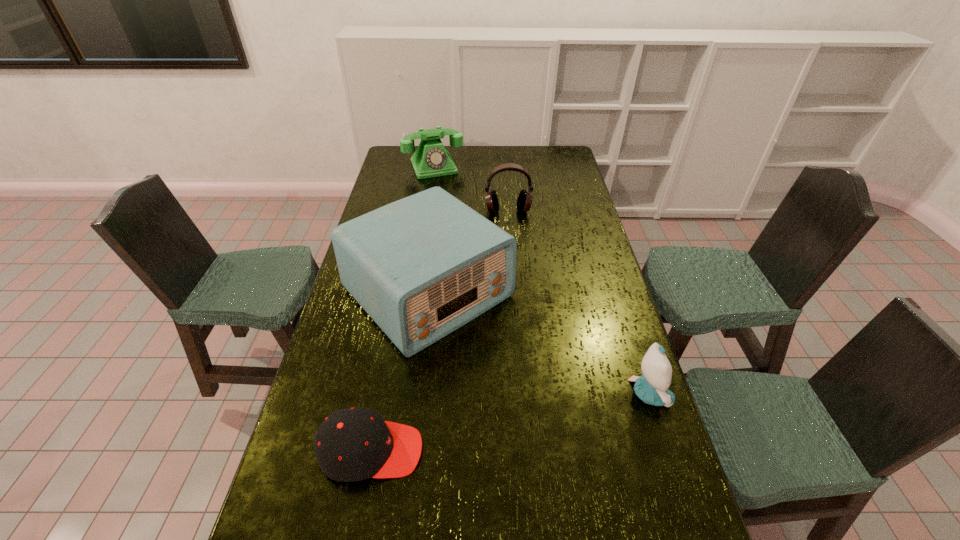
Locate an element on the screen. The image size is (960, 540). the shortest object is located at coordinates (352, 444).

Find the location of a particular element. the nearest object is located at coordinates (352, 444).

Identify the location of kitten. (652, 387).

The width and height of the screenshot is (960, 540). What are the coordinates of `the second shortest object` in the screenshot? It's located at (652, 387).

Find the location of a particular element. The height and width of the screenshot is (540, 960). radio receiver is located at coordinates (423, 266).

What are the coordinates of `the third farthest object` in the screenshot? It's located at (423, 266).

What are the coordinates of `the farthest object` in the screenshot? It's located at (431, 159).

The image size is (960, 540). What are the coordinates of `the second farthest object` in the screenshot? It's located at (524, 201).

Where is `blank space located 0.400m on the front-facing side of the shortest object`? blank space located 0.400m on the front-facing side of the shortest object is located at coordinates (584, 451).

This screenshot has width=960, height=540. I want to click on free space located on the front panel of the tallest object, so click(x=574, y=427).